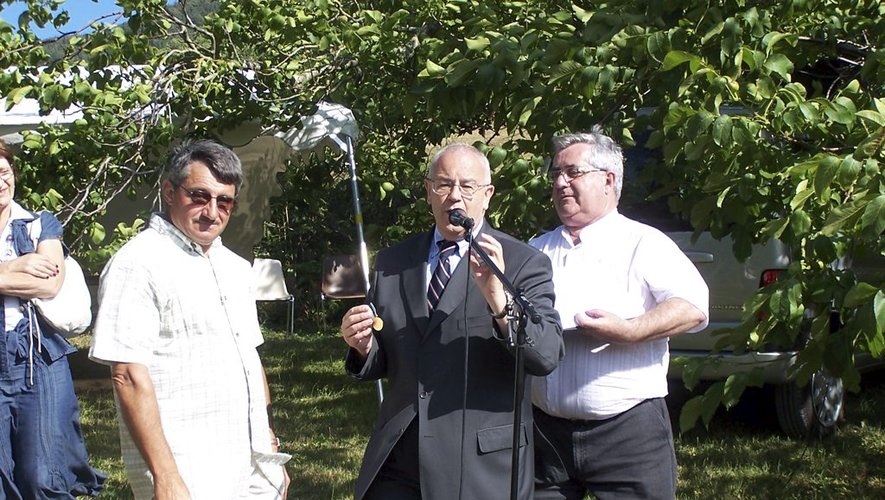
Locate an element on the screen. This screenshot has height=500, width=885. mic is located at coordinates (447, 252).